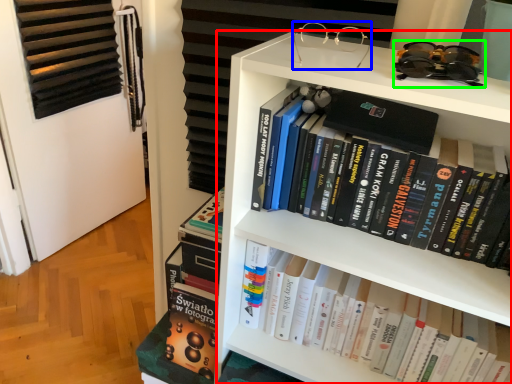
Question: Which is farther away from bookcase (highlighted by a red box)? glasses (highlighted by a blue box) or glasses (highlighted by a green box)?

Choices:
 (A) glasses
 (B) glasses

Answer: (A)